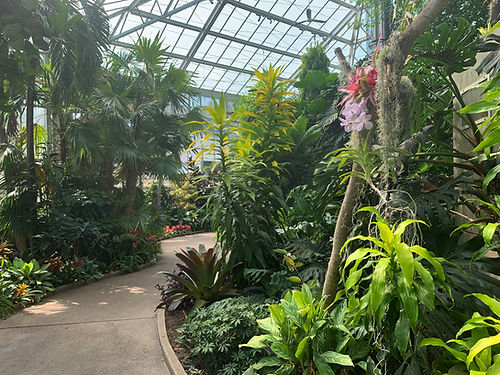
In order to click on ceiling fan in this screenshot , I will do `click(310, 19)`.